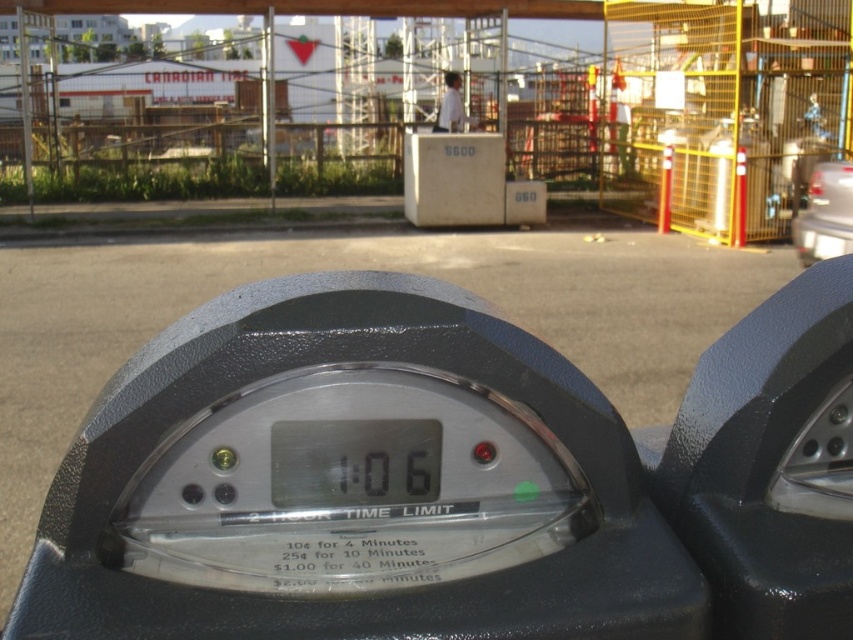
Question: Can you confirm if black plastic parking meter at center is positioned to the right of metal scaffolding at center?

Choices:
 (A) no
 (B) yes

Answer: (B)

Question: Can you confirm if metal scaffolding at center is bigger than metallic silver car at right?

Choices:
 (A) no
 (B) yes

Answer: (B)

Question: Considering the real-world distances, which object is closest to the metallic silver car at right?

Choices:
 (A) metal scaffolding at center
 (B) black plastic parking meter at center

Answer: (A)

Question: Which of the following is the closest to the observer?

Choices:
 (A) (814, 420)
 (B) (206, 604)
 (C) (813, 228)

Answer: (B)

Question: Does metal scaffolding at center appear under black matte parking meter at center?

Choices:
 (A) yes
 (B) no

Answer: (B)

Question: Based on their relative distances, which object is nearer to the black matte parking meter at center?

Choices:
 (A) black plastic parking meter at center
 (B) metal scaffolding at center
 (C) white shirt at upper center
 (D) metallic silver car at right

Answer: (A)